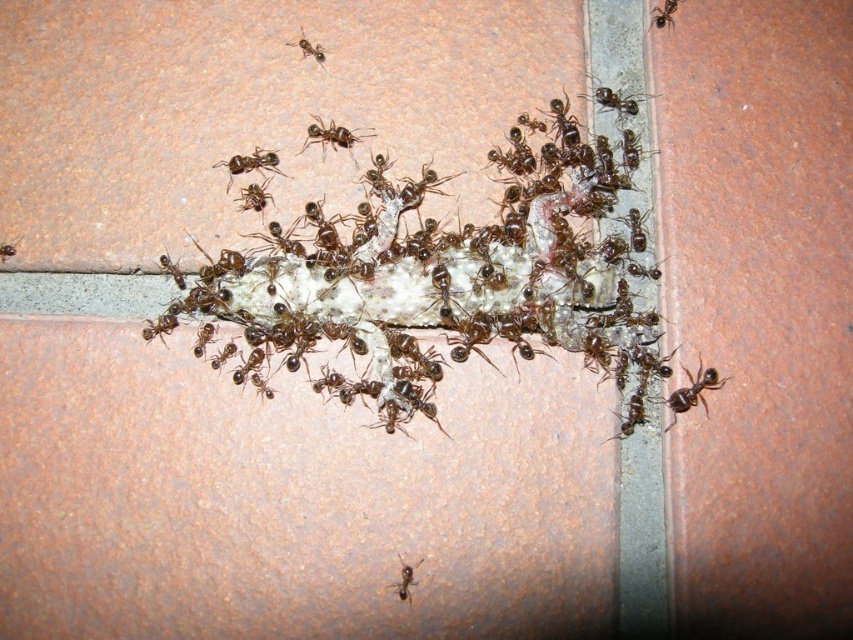
Question: Is brown matte ant at lower center below brown shiny ant at upper right?

Choices:
 (A) no
 (B) yes

Answer: (B)

Question: Which is nearer to the brown shiny ant at upper right?

Choices:
 (A) brown shiny ant at upper center
 (B) brown glossy ant at upper center
 (C) brown matte ant at lower center

Answer: (B)

Question: Which point is farther to the camera?

Choices:
 (A) (270, 170)
 (B) (363, 138)

Answer: (B)

Question: Is the position of brown glossy ant at upper left less distant than that of black glossy ant at upper left?

Choices:
 (A) no
 (B) yes

Answer: (A)

Question: In this image, where is brown glossy ant at upper left located relative to brown shiny ant at upper center?

Choices:
 (A) left
 (B) right

Answer: (A)

Question: Estimate the real-world distances between objects in this image. Which object is closer to the brown glossy ant at upper left?

Choices:
 (A) brown glossy ant at upper center
 (B) brown shiny ant at upper right
 (C) brown matte ant at lower center
 (D) brown shiny ant at upper center

Answer: (D)